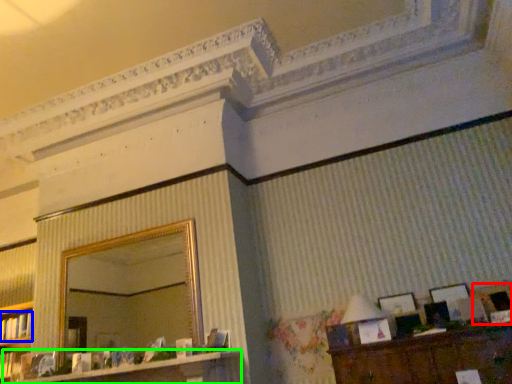
Question: Which object is the closest to the picture frame (highlighted by a red box)? Choose among these: book (highlighted by a blue box) or dresser (highlighted by a green box).

Choices:
 (A) book
 (B) dresser

Answer: (B)